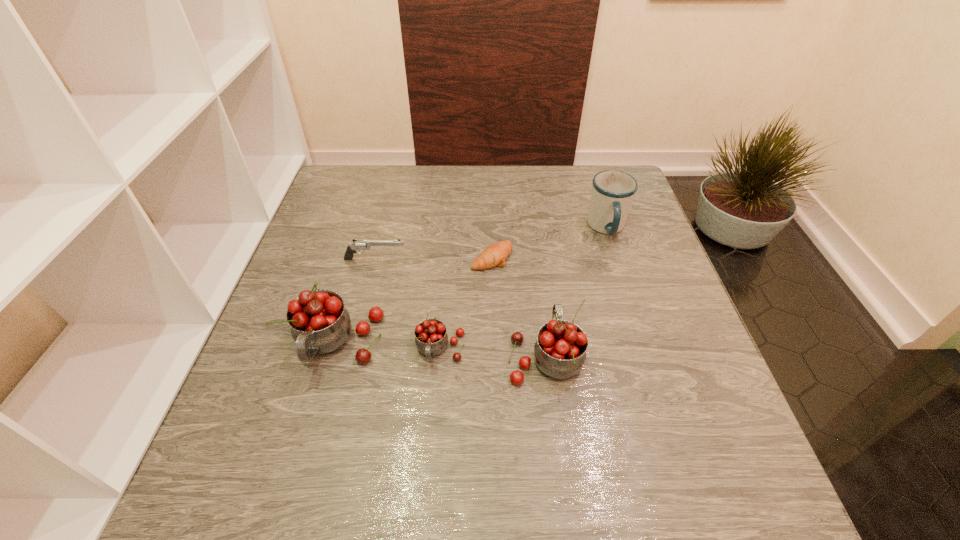
Find the location of a particular element. The height and width of the screenshot is (540, 960). free location at the far edge of the desktop is located at coordinates (420, 210).

Image resolution: width=960 pixels, height=540 pixels. What are the coordinates of `vacant space at the left edge of the desktop` in the screenshot? It's located at (360, 218).

I want to click on blank area at the right edge, so click(x=629, y=325).

What are the coordinates of `vacant space at the far left corner` in the screenshot? It's located at (353, 179).

Find the location of `vacant space that's between the second shortest object and the rightmost cherry`. vacant space that's between the second shortest object and the rightmost cherry is located at coordinates (460, 307).

Image resolution: width=960 pixels, height=540 pixels. I want to click on free space between the shortest object and the shortest cherry, so click(466, 303).

The width and height of the screenshot is (960, 540). I want to click on free point between the second shortest cherry and the second shortest object, so click(460, 307).

Identify the location of empty space between the leftmost cherry and the third shortest object. This screenshot has width=960, height=540. (389, 347).

This screenshot has height=540, width=960. I want to click on empty location between the leftmost cherry and the crescent roll, so click(415, 301).

At what (x,y) coordinates should I click in order to perform the action: click on free space between the crescent roll and the rightmost object. Please return your answer as a coordinate pair (x, y). Image resolution: width=960 pixels, height=540 pixels. Looking at the image, I should click on (549, 243).